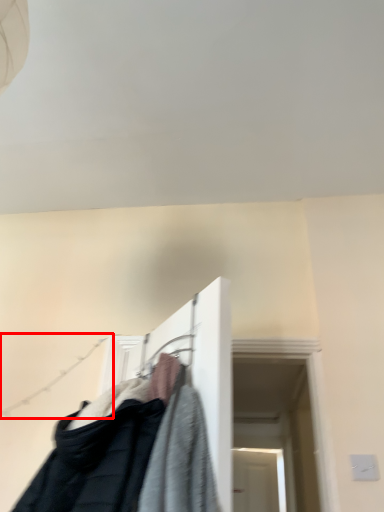
Question: Observing the image, what is the correct spatial positioning of clothesline (annotated by the red box) in reference to closet?

Choices:
 (A) right
 (B) left

Answer: (B)